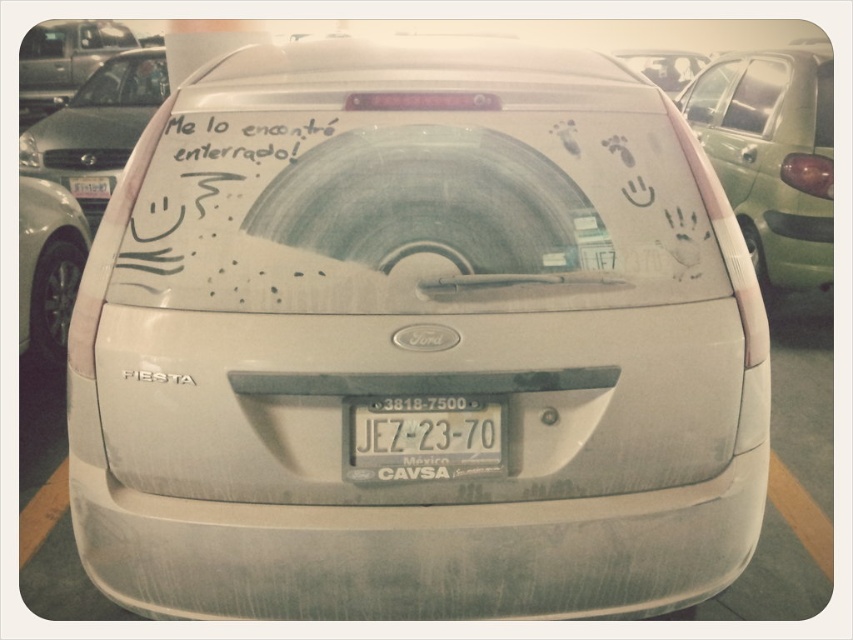
Question: Can you confirm if green matte surfboard at right is wider than matte silver truck at upper left?

Choices:
 (A) no
 (B) yes

Answer: (A)

Question: Does silver metallic car at left appear on the right side of white matte car at upper center?

Choices:
 (A) no
 (B) yes

Answer: (A)

Question: Among these points, which one is nearest to the camera?

Choices:
 (A) (672, 72)
 (B) (354, 452)
 (C) (45, 38)

Answer: (B)

Question: Considering the real-world distances, which object is closest to the white plastic license plate at center?

Choices:
 (A) silver metallic car at left
 (B) white matte car at upper center
 (C) matte silver truck at upper left

Answer: (A)

Question: Which point is farther from the camera taking this photo?

Choices:
 (A) (33, 36)
 (B) (440, 429)
 (C) (793, 56)

Answer: (A)

Question: Where is green matte surfboard at right located in relation to white plastic license plate at center in the image?

Choices:
 (A) above
 (B) below

Answer: (A)